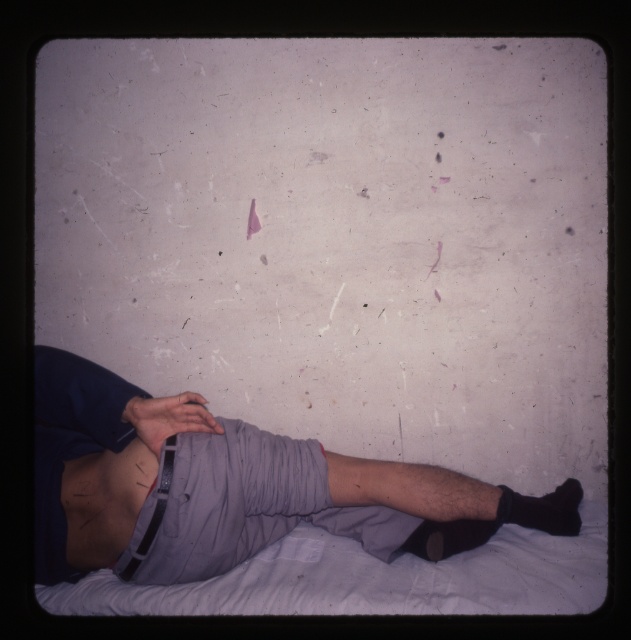
Which is below, gray cotton shorts at center or white fabric bed at lower center?

white fabric bed at lower center is below.

Does gray cotton shorts at center have a lesser height compared to white fabric bed at lower center?

Incorrect, gray cotton shorts at center's height does not fall short of white fabric bed at lower center's.

The width and height of the screenshot is (631, 640). Identify the location of gray cotton shorts at center. (213, 484).

Can you confirm if white fabric bed at lower center is positioned to the left of smooth skin at lower center?

No, white fabric bed at lower center is not to the left of smooth skin at lower center.

Locate an element on the screen. Image resolution: width=631 pixels, height=640 pixels. white fabric bed at lower center is located at coordinates (372, 579).

The image size is (631, 640). I want to click on white fabric bed at lower center, so click(x=372, y=579).

Does gray cotton shorts at center lie behind smooth skin at lower center?

That is False.

Between point (110, 557) and point (131, 445), which one is positioned in front?

Point (110, 557) is in front.

Locate an element on the screen. The height and width of the screenshot is (640, 631). gray cotton shorts at center is located at coordinates (213, 484).